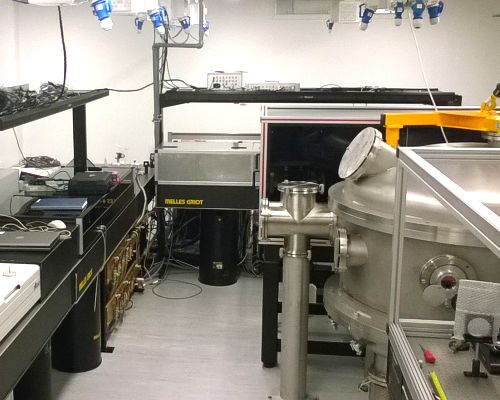
In order to click on screen in this screenshot , I will do `click(308, 148)`.